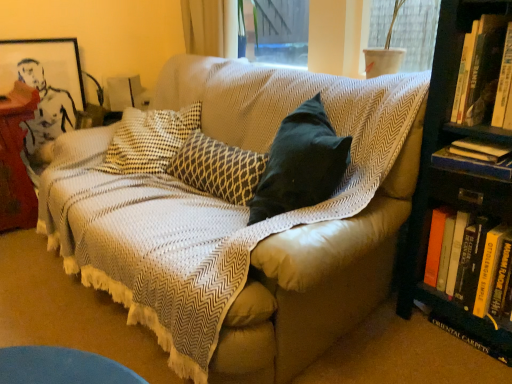
Question: Considering the relative positions of white plastic pot at upper right and hardcover book at right, arranged as the first book when ordered from the bottom, in the image provided, is white plastic pot at upper right to the left or to the right of hardcover book at right, arranged as the first book when ordered from the bottom,?

Choices:
 (A) left
 (B) right

Answer: (A)

Question: Is white plastic pot at upper right inside or outside of hardcover book at right, arranged as the first book when ordered from the bottom?

Choices:
 (A) inside
 (B) outside

Answer: (B)

Question: Which object is the farthest from the hardcover book at right, the third book ordered from the bottom?

Choices:
 (A) white plastic pot at upper right
 (B) hardcover book at right, arranged as the first book when ordered from the bottom
 (C) textured beige couch at center
 (D) hardcover book at right, placed as the first book when sorted from top to bottom
 (E) matte black picture frame at upper left

Answer: (E)

Question: Which is farther from the white plastic pot at upper right?

Choices:
 (A) matte black picture frame at upper left
 (B) hardcover book at right, the third book ordered from the bottom
 (C) textured beige couch at center
 (D) hardcover book at right, which ranks as the second book in bottom-to-top order
 (E) hardcover book at right, placed as the first book when sorted from top to bottom

Answer: (A)